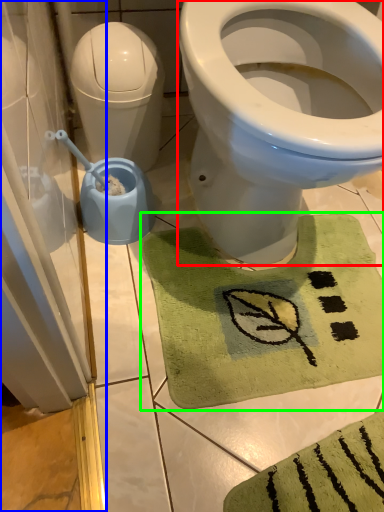
Question: Which object is positioned farthest from bidet (highlighted by a red box)? Select from screen door (highlighted by a blue box) and bath mat (highlighted by a green box).

Choices:
 (A) screen door
 (B) bath mat

Answer: (A)